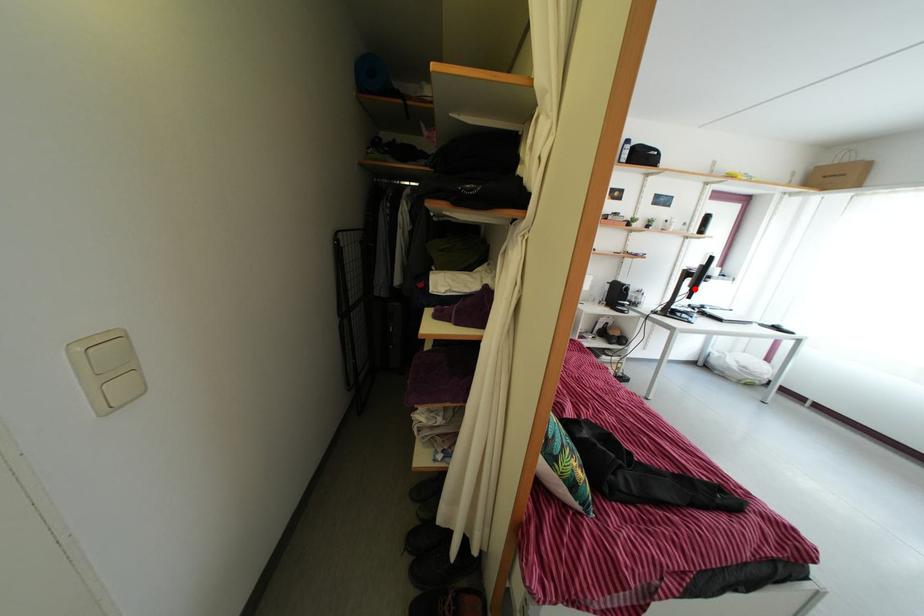
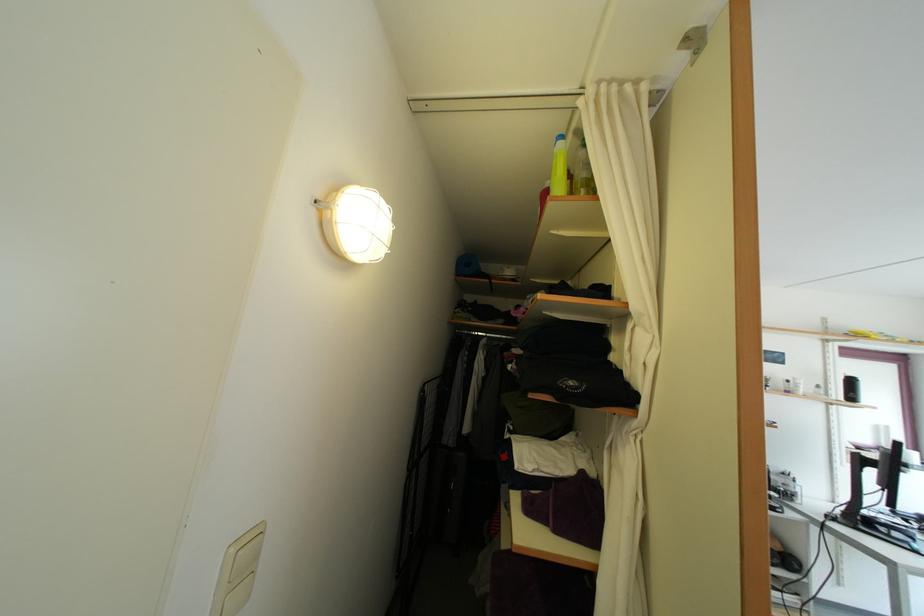
Locate, in the second image, the point that corresponds to the highlighted location in the first image.

(878, 480)